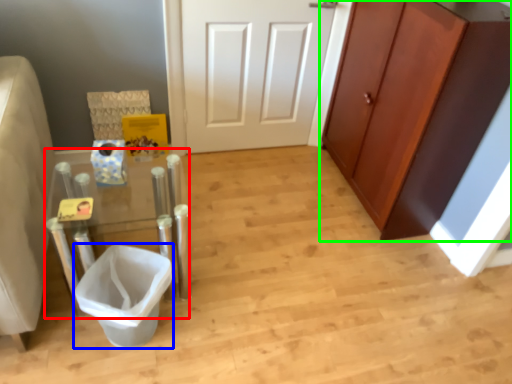
Question: Estimate the real-world distances between objects in this image. Which object is closer to vanity (highlighted by a red box), toilet bowl (highlighted by a blue box) or cabinetry (highlighted by a green box)?

Choices:
 (A) toilet bowl
 (B) cabinetry

Answer: (A)